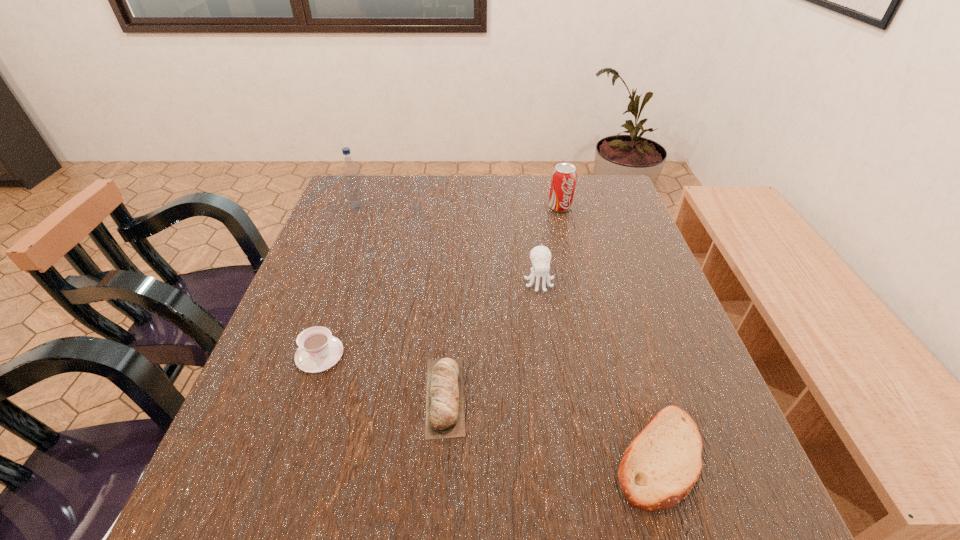
Find the location of `empty space that is in between the water bottle and the third object from right to left`. empty space that is in between the water bottle and the third object from right to left is located at coordinates (448, 245).

Identify the location of free space between the tallest object and the right pita bread. This screenshot has height=540, width=960. (508, 332).

The image size is (960, 540). I want to click on unoccupied area between the teacup and the fourth nearest object, so click(429, 318).

Where is `unoccupied area between the fourth shortest object and the fifth shortest object`? The image size is (960, 540). unoccupied area between the fourth shortest object and the fifth shortest object is located at coordinates (549, 244).

This screenshot has width=960, height=540. I want to click on vacant space that is in between the third tallest object and the right pita bread, so click(x=598, y=369).

Locate an element on the screen. This screenshot has width=960, height=540. vacant space that's between the teacup and the tallest object is located at coordinates (339, 281).

Find the location of a particular element. This screenshot has width=960, height=540. vacant area that lies between the teacup and the water bottle is located at coordinates (339, 281).

You are a GUI agent. You are given a task and a screenshot of the screen. Output one action in this format:
    pyautogui.click(x=<x>, y=<y>)
    Task: Click on the unoccupied area between the teacup and the fourth object from right to left
    
    Given the screenshot: What is the action you would take?
    pyautogui.click(x=382, y=375)

This screenshot has width=960, height=540. Find the location of `empty location between the taller pita bread and the teacup`. empty location between the taller pita bread and the teacup is located at coordinates (382, 375).

Choose which object is the nearest neighbor to the second tallest object. Please provide its 2D coordinates. Your answer should be formatted as a tuple, i.e. [(x, y)], where the tuple contains the x and y coordinates of a point satisfying the conditions above.

[(540, 256)]